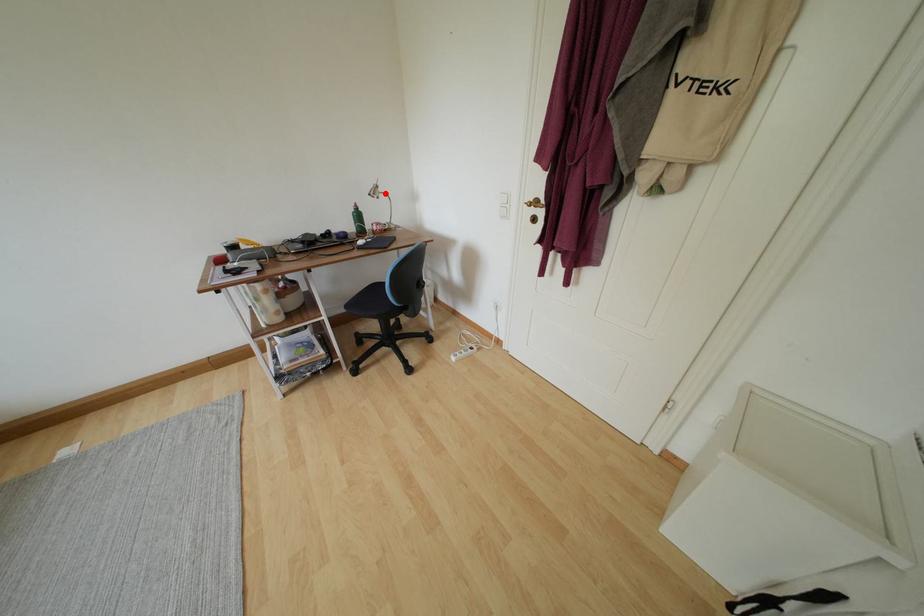
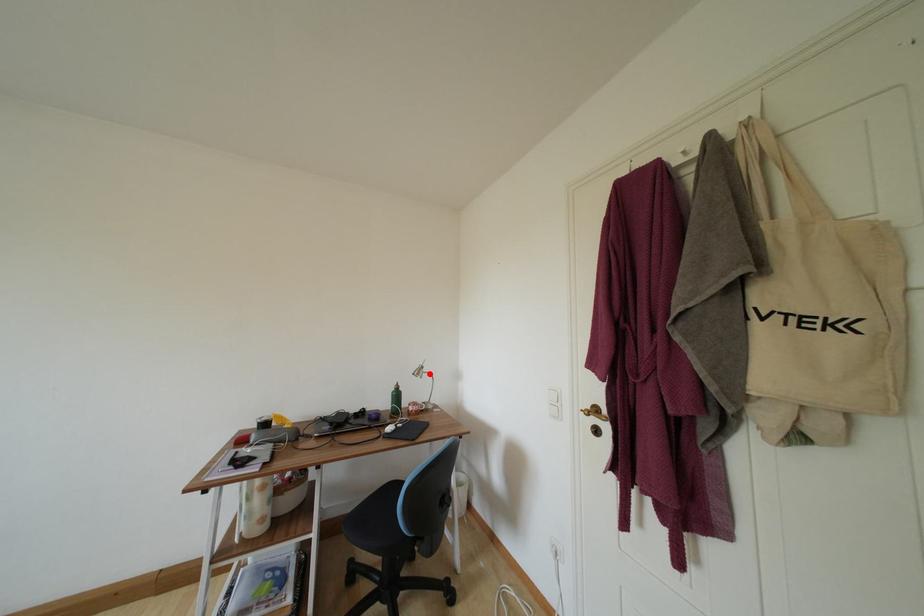
I am providing you with two images of the same scene from different viewpoints. A red point is marked on the first image and another point is marked on the second image. Are the points marked in image1 and image2 representing the same 3D position?

Yes